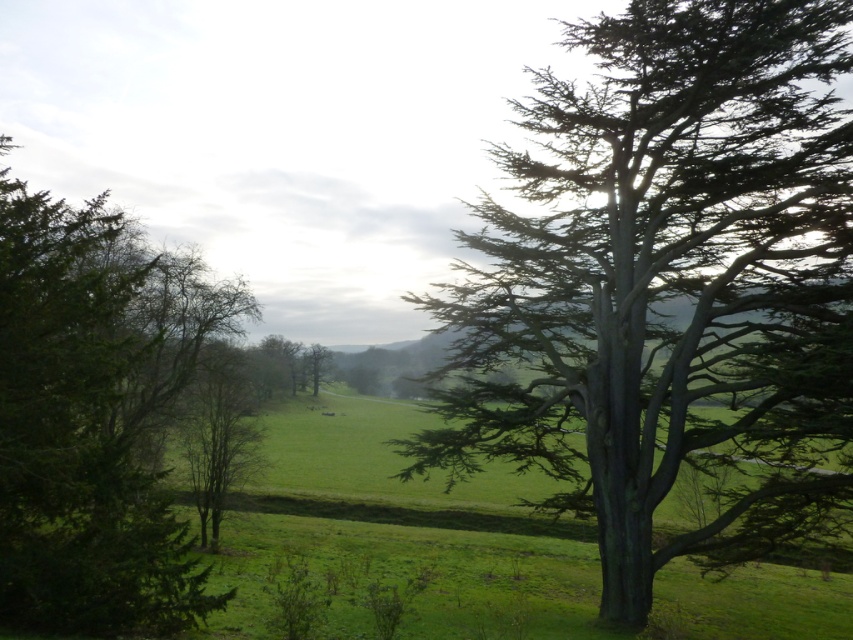
You are planning to plant a new tree in your garden. You have two options based on the image provided. Which of the two trees, the green textured tree at right or the green matte tree at left, would you choose if you want a smaller tree for limited space?

The green textured tree at right has a smaller size compared to the green matte tree at left, so it would be the better choice for limited space.

You are a bird looking for a nesting spot. You see the green matte tree at left and the bare branches at center. Which tree would provide a higher nesting position?

The green matte tree at left is much taller than the bare branches at center, so it would provide a higher nesting position.